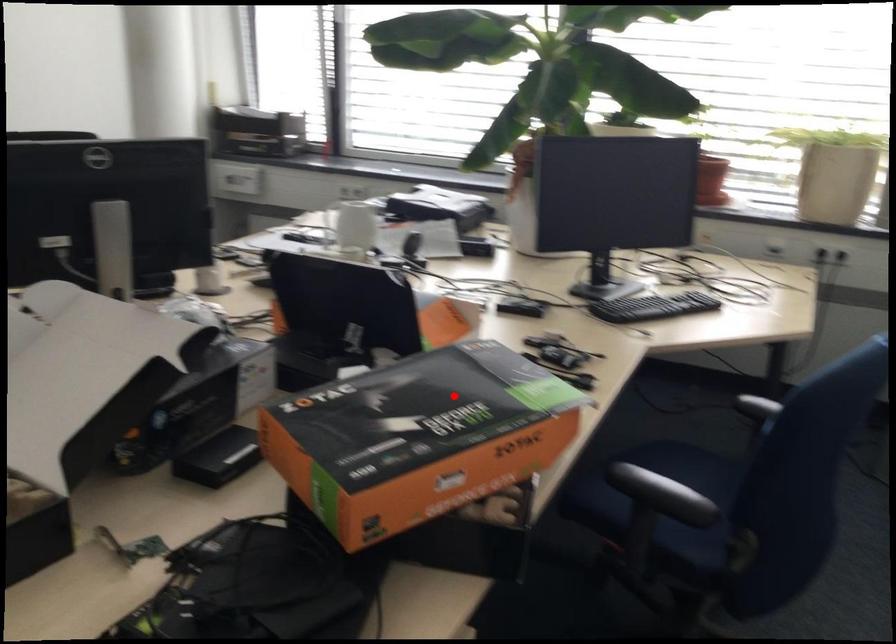
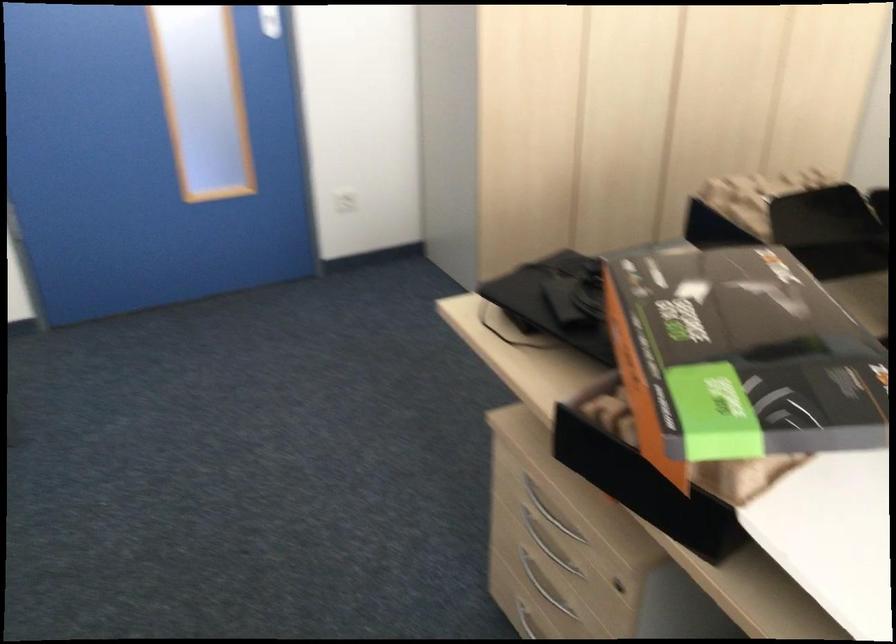
Question: I am providing you with two images of the same scene from different viewpoints. Image1 has a red point marked. In image2, the corresponding 3D location appears at what relative position? Reply with the corresponding letter.

Choices:
 (A) Closer
 (B) Farther

Answer: (A)